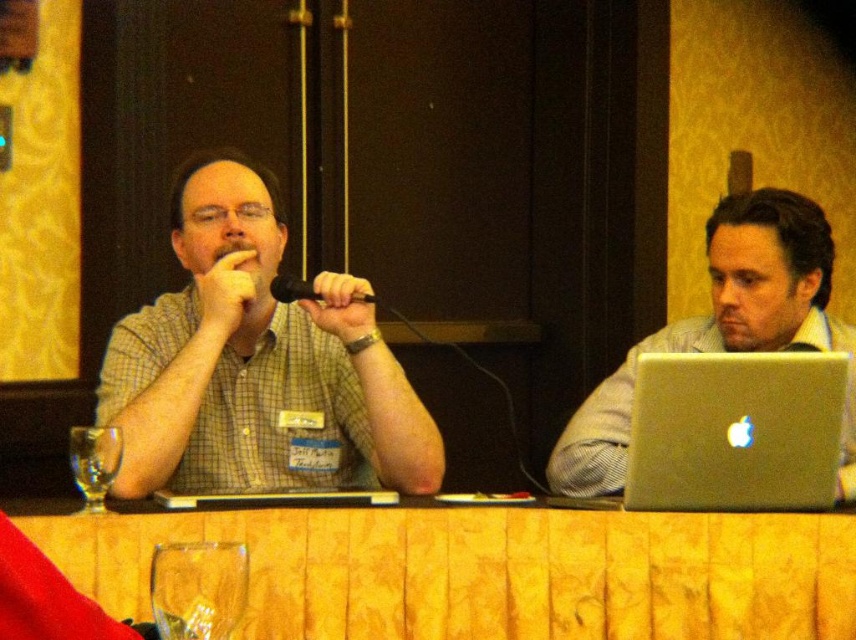
Is green checkered shirt at center bigger than clear glass wine glass at lower left?

Correct, green checkered shirt at center is larger in size than clear glass wine glass at lower left.

Between point (235, 480) and point (207, 545), which one is positioned behind?

Point (235, 480)

Image resolution: width=856 pixels, height=640 pixels. What do you see at coordinates (254, 364) in the screenshot? I see `green checkered shirt at center` at bounding box center [254, 364].

I want to click on green checkered shirt at center, so click(254, 364).

Which is behind, point (761, 381) or point (189, 593)?

The point (761, 381) is behind.

Between silver metallic laptop at center and clear glass wine glass at lower left, which one appears on the left side from the viewer's perspective?

From the viewer's perspective, clear glass wine glass at lower left appears more on the left side.

Measure the distance between point (810, 476) and camera.

A distance of 5.62 feet exists between point (810, 476) and camera.

Where is `silver metallic laptop at center`? This screenshot has height=640, width=856. silver metallic laptop at center is located at coordinates (735, 432).

Between silver metallic laptop at center and silver metallic laptop at right, which one is positioned lower?

Positioned lower is silver metallic laptop at center.

Does point (788, 355) come in front of point (759, 227)?

That is True.

Who is more distant from viewer, (657, 410) or (703, 323)?

The point (703, 323) is more distant.

Image resolution: width=856 pixels, height=640 pixels. I want to click on silver metallic laptop at center, so click(735, 432).